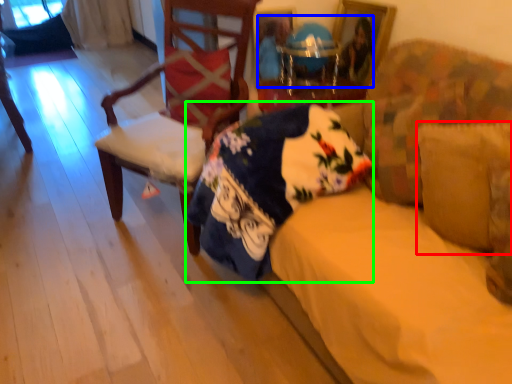
Question: Which object is positioned closest to pillow (highlighted by a red box)? Select from couple (highlighted by a blue box) and blanket (highlighted by a green box).

Choices:
 (A) couple
 (B) blanket

Answer: (B)